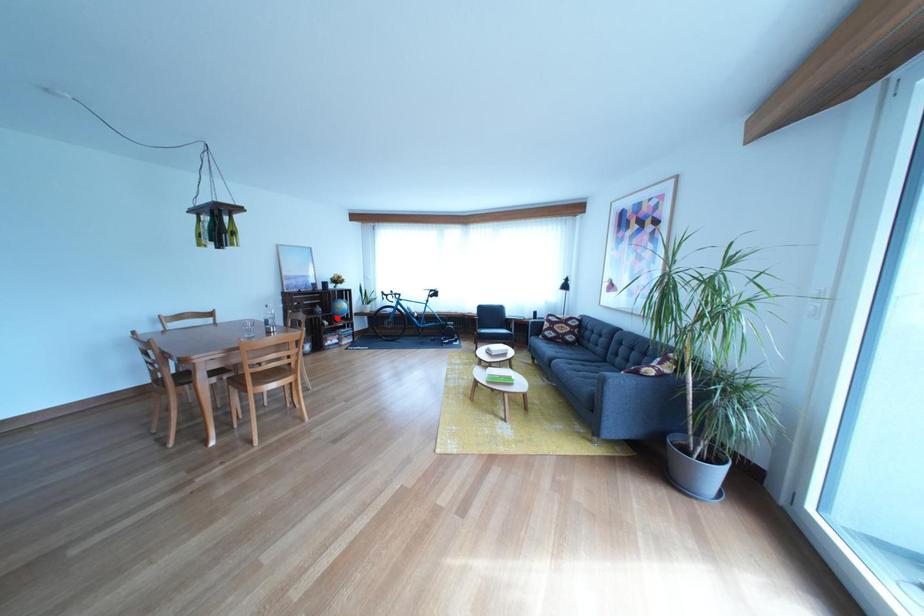
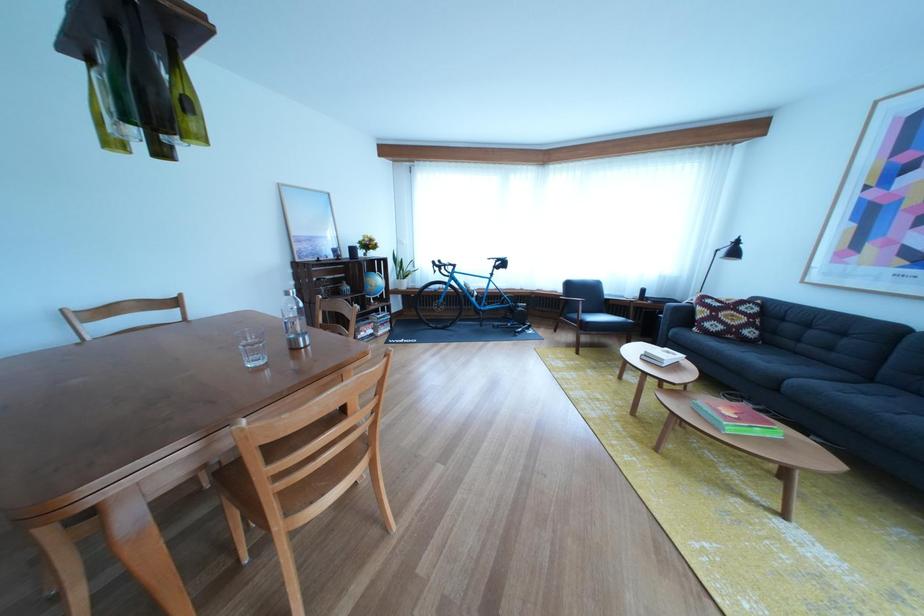
Locate, in the second image, the point that corresponds to the highlighted location in the first image.

(367, 297)